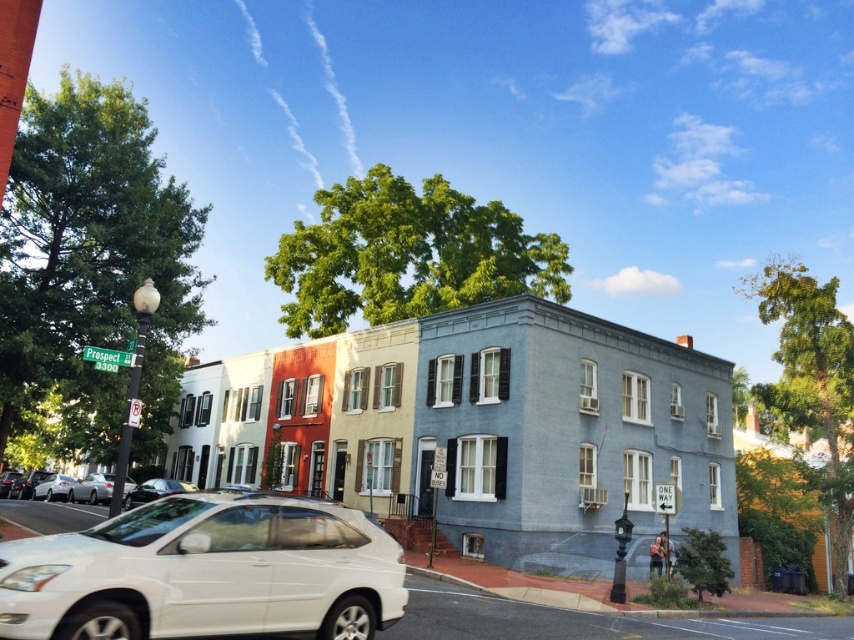
Who is positioned more to the left, metallic silver sedan at center or silver metallic sedan at lower left?

From the viewer's perspective, silver metallic sedan at lower left appears more on the left side.

Which is behind, point (186, 484) or point (47, 490)?

Positioned behind is point (47, 490).

I want to click on metallic silver sedan at center, so click(154, 490).

Between silver metallic sedan at center and metallic silver sedan at center, which one is positioned higher?

silver metallic sedan at center is above.

Can you confirm if silver metallic sedan at center is thinner than metallic silver sedan at center?

In fact, silver metallic sedan at center might be wider than metallic silver sedan at center.

What do you see at coordinates (92, 488) in the screenshot? The width and height of the screenshot is (854, 640). I see `silver metallic sedan at center` at bounding box center [92, 488].

At what (x,y) coordinates should I click in order to perform the action: click on silver metallic sedan at center. Please return your answer as a coordinate pair (x, y). Looking at the image, I should click on (92, 488).

Who is positioned more to the left, white matte car at lower left or matte white sedan at center?

white matte car at lower left is more to the left.

This screenshot has height=640, width=854. Find the location of `white matte car at lower left`. white matte car at lower left is located at coordinates (205, 572).

Identify the location of white matte car at lower left. (205, 572).